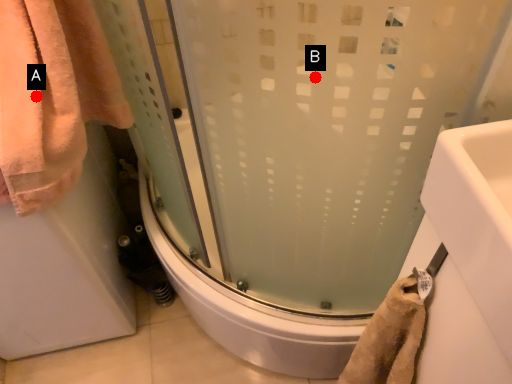
Question: Two points are circled on the image, labeled by A and B beside each circle. Which point is closer to the camera?

Choices:
 (A) A is closer
 (B) B is closer

Answer: (B)